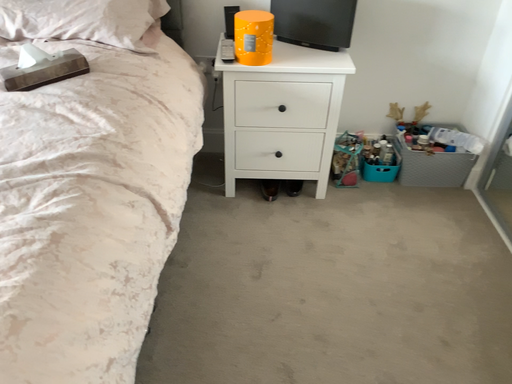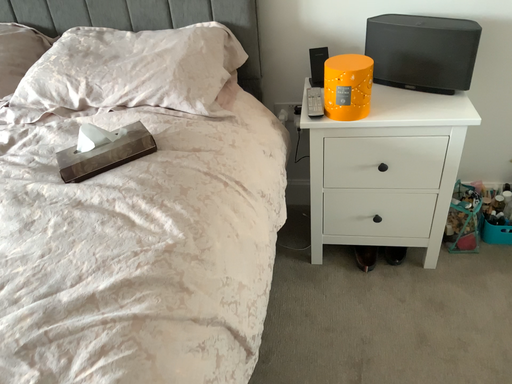
Question: Which way did the camera rotate in the video?

Choices:
 (A) rotated left
 (B) rotated right

Answer: (A)